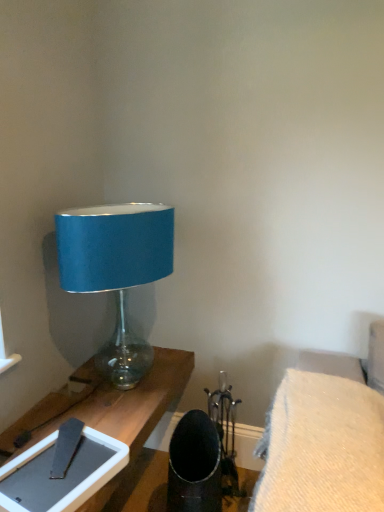
Question: Does woolen fabric cushion at lower right have a lesser width compared to matte gray tablet at lower left?

Choices:
 (A) yes
 (B) no

Answer: (B)

Question: Can you confirm if woolen fabric cushion at lower right is wider than matte gray tablet at lower left?

Choices:
 (A) yes
 (B) no

Answer: (A)

Question: Considering the relative positions of woolen fabric cushion at lower right and matte gray tablet at lower left in the image provided, is woolen fabric cushion at lower right to the left of matte gray tablet at lower left from the viewer's perspective?

Choices:
 (A) no
 (B) yes

Answer: (A)

Question: Considering the relative sizes of woolen fabric cushion at lower right and matte gray tablet at lower left in the image provided, is woolen fabric cushion at lower right shorter than matte gray tablet at lower left?

Choices:
 (A) yes
 (B) no

Answer: (B)

Question: Considering the relative positions of woolen fabric cushion at lower right and matte gray tablet at lower left in the image provided, is woolen fabric cushion at lower right behind matte gray tablet at lower left?

Choices:
 (A) no
 (B) yes

Answer: (A)

Question: Can you confirm if woolen fabric cushion at lower right is bigger than matte gray tablet at lower left?

Choices:
 (A) no
 (B) yes

Answer: (B)

Question: Can you confirm if blue fabric lampshade at left is wider than matte gray tablet at lower left?

Choices:
 (A) yes
 (B) no

Answer: (A)

Question: Is there a large distance between blue fabric lampshade at left and matte gray tablet at lower left?

Choices:
 (A) no
 (B) yes

Answer: (A)

Question: Is blue fabric lampshade at left next to matte gray tablet at lower left?

Choices:
 (A) yes
 (B) no

Answer: (B)

Question: Is blue fabric lampshade at left oriented towards matte gray tablet at lower left?

Choices:
 (A) yes
 (B) no

Answer: (B)

Question: Is blue fabric lampshade at left to the right of matte gray tablet at lower left from the viewer's perspective?

Choices:
 (A) no
 (B) yes

Answer: (B)

Question: Considering the relative positions of blue fabric lampshade at left and matte gray tablet at lower left in the image provided, is blue fabric lampshade at left in front of matte gray tablet at lower left?

Choices:
 (A) yes
 (B) no

Answer: (B)

Question: Considering the relative sizes of matte gray tablet at lower left and blue fabric lampshade at left in the image provided, is matte gray tablet at lower left smaller than blue fabric lampshade at left?

Choices:
 (A) no
 (B) yes

Answer: (B)